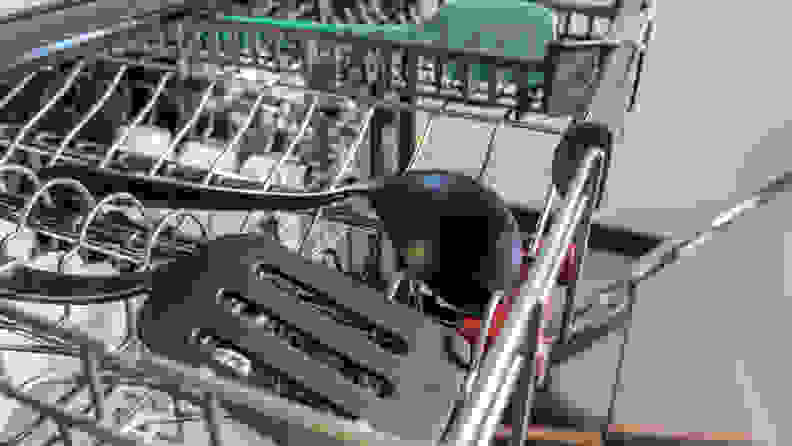
Where is `green spatula handle`? The image size is (792, 446). green spatula handle is located at coordinates (401, 33).